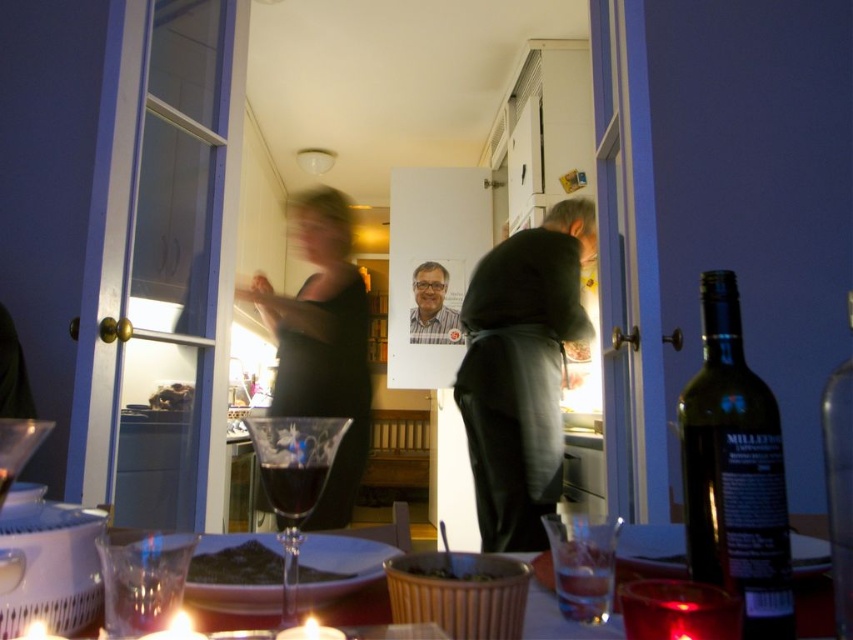
Question: Can you confirm if translucent glass bottle at right is positioned to the right of smooth brown rice at center?

Choices:
 (A) no
 (B) yes

Answer: (B)

Question: Which point is closer to the camera?

Choices:
 (A) dark glass wine at center
 (B) transparent crystal wine glass at center

Answer: (A)

Question: Among these objects, which one is nearest to the camera?

Choices:
 (A) dark glass bottle at right
 (B) translucent glass candle at lower center

Answer: (A)

Question: Which of the following is the closest to the observer?

Choices:
 (A) (418, 572)
 (B) (532, 541)
 (C) (647, 532)

Answer: (A)

Question: Is dark gray hoodie at center wider than transparent glass at lower center?

Choices:
 (A) yes
 (B) no

Answer: (A)

Question: Does transparent crystal wine glass at center have a smaller size compared to smooth chocolate bar at center?

Choices:
 (A) yes
 (B) no

Answer: (B)